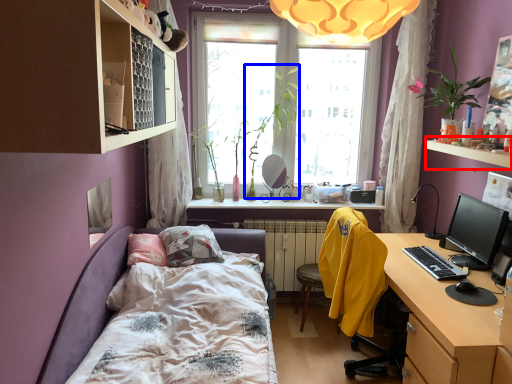
Question: Which point is further to the camera, window sill (highlighted by a red box) or plant (highlighted by a blue box)?

Choices:
 (A) window sill
 (B) plant

Answer: (B)